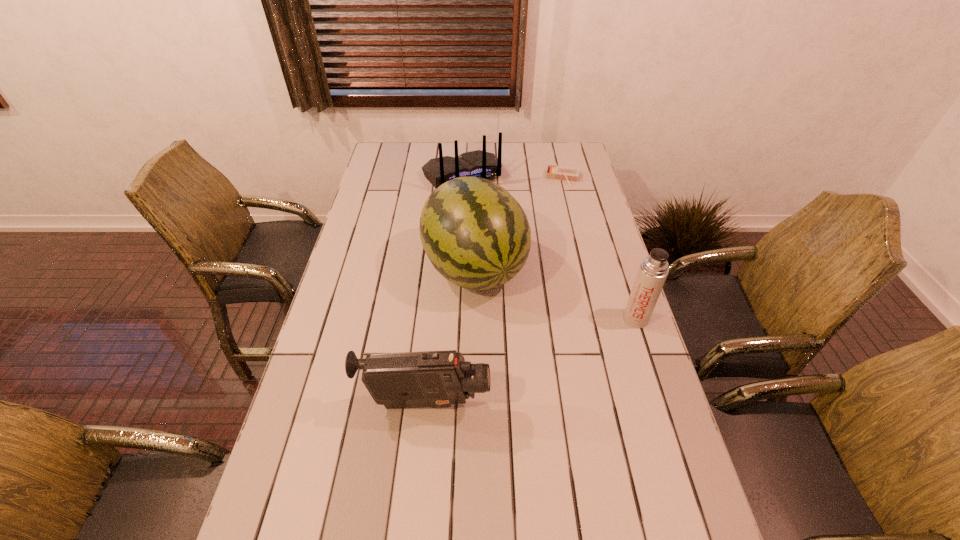
This screenshot has width=960, height=540. I want to click on free spot on the desktop that is between the camcorder and the thermos bottle and is positioned on the back of the router, so click(x=568, y=346).

Locate an element on the screen. free spot on the desktop that is between the nearest object and the second tallest object and is positioned on the striking surface of the second object from right to left is located at coordinates (535, 359).

I want to click on vacant space on the desktop that is between the camcorder and the rightmost object and is positioned at the stem end of the watermelon, so tap(537, 359).